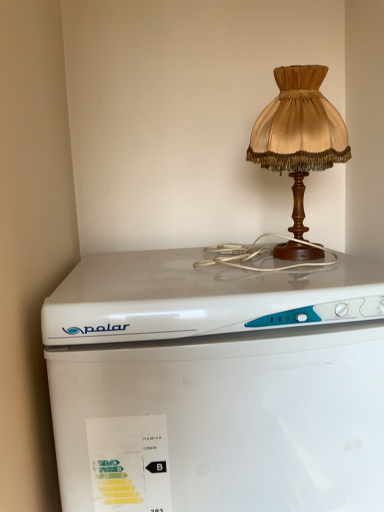
At what (x,y) coordinates should I click in order to perform the action: click on blank space situated above white plastic refrigerator at center (from a real-world perspective). Please return your answer as a coordinate pair (x, y). Image resolution: width=384 pixels, height=512 pixels. Looking at the image, I should click on (211, 275).